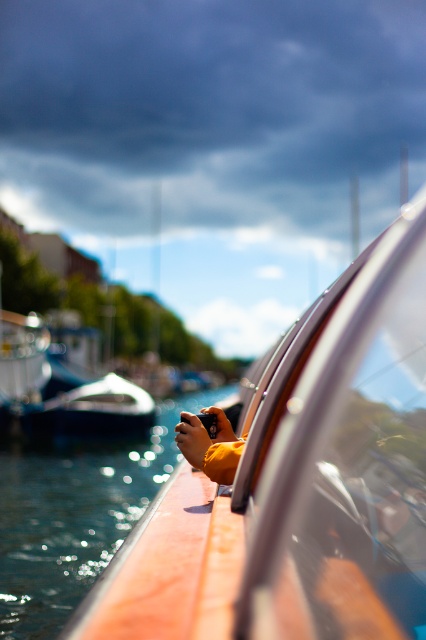
Question: Among these points, which one is nearest to the camera?

Choices:
 (A) (118, 534)
 (B) (307, 548)
 (C) (152, 403)

Answer: (B)

Question: Does transparent glass car window at center come in front of clear water at boat right?

Choices:
 (A) no
 (B) yes

Answer: (B)

Question: Does clear water at boat right have a greater width compared to white glossy boat at center?

Choices:
 (A) yes
 (B) no

Answer: (A)

Question: From the image, what is the correct spatial relationship of clear water at boat right in relation to white glossy boat at center?

Choices:
 (A) right
 (B) left

Answer: (A)

Question: Estimate the real-world distances between objects in this image. Which object is closer to the clear water at boat right?

Choices:
 (A) white glossy boat at center
 (B) transparent glass car window at center

Answer: (A)

Question: Estimate the real-world distances between objects in this image. Which object is closer to the transparent glass car window at center?

Choices:
 (A) clear water at boat right
 (B) white glossy boat at center

Answer: (A)